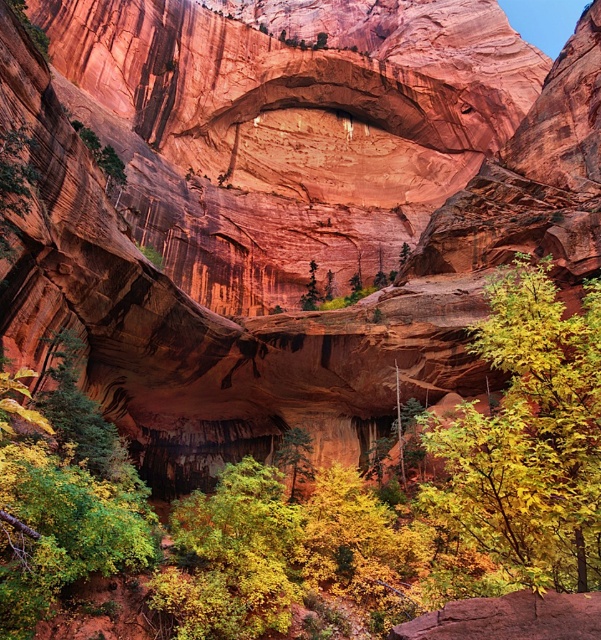
You are standing at the camera position and want to reach the point marked at coordinates (x=230, y=531). If you walk straight towards it, how far will you have to walk?

The point marked at coordinates (x=230, y=531) is 64.07 meters away from the camera, so you will have to walk 64.07 meters straight towards it to reach that point.